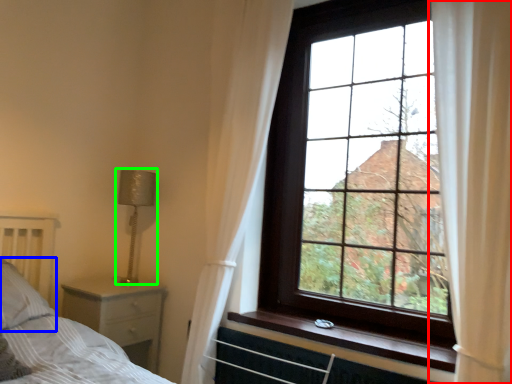
Question: Which object is positioned farthest from curtain (highlighted by a red box)? Select from pillow (highlighted by a blue box) and lamp (highlighted by a green box).

Choices:
 (A) pillow
 (B) lamp

Answer: (A)